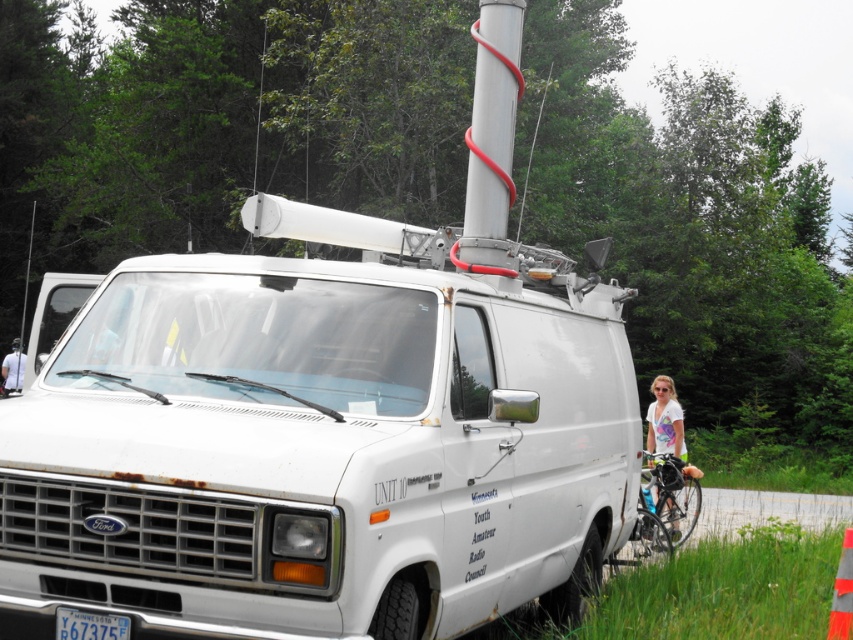
You are a delivery person who needs to load a 6 meter long ladder onto the shiny black bicycle at right. Can you safely place the ladder on the bicycle without it extending beyond the bicycle?

The ladder is 6 meters long, and the distance between the van and the shiny black bicycle at right is 5.77 meters. Since the ladder is longer than the available space between them, it cannot be safely placed on the bicycle without extending beyond it.

What is the 2D coordinate of the white matte van at center?

The white matte van at center is located at the 2D coordinate point of (325, 438).